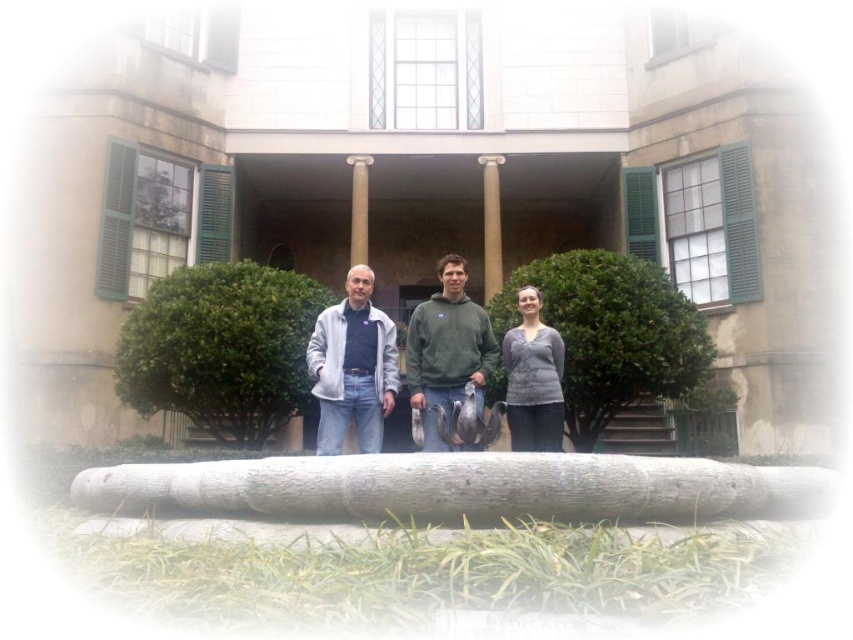
Question: Among these objects, which one is farthest from the camera?

Choices:
 (A) matte gray hoodie at center
 (B) smooth stone column at center
 (C) gray rough log at center
 (D) smooth tan column at center

Answer: (D)

Question: Is gray matte sweater at center closer to camera compared to smooth stone column at center?

Choices:
 (A) yes
 (B) no

Answer: (A)

Question: Which object is the closest to the matte gray hoodie at center?

Choices:
 (A) green fleece at center
 (B) light gray fleece jacket at center
 (C) smooth stone column at center
 (D) gray matte sweater at center

Answer: (A)

Question: Does matte gray hoodie at center appear on the right side of green fleece at center?

Choices:
 (A) no
 (B) yes

Answer: (A)

Question: Which of the following is the closest to the observer?

Choices:
 (A) (407, 349)
 (B) (369, 161)
 (C) (372, 408)

Answer: (C)

Question: Does light gray fleece jacket at center appear on the right side of gray matte sweater at center?

Choices:
 (A) no
 (B) yes

Answer: (A)